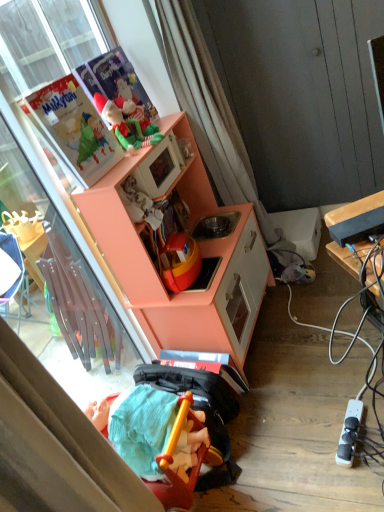
Question: Is peach matte cabinet at upper left situated inside green felt elf at upper center, arranged as the first toy when viewed from the top, or outside?

Choices:
 (A) inside
 (B) outside

Answer: (B)

Question: Based on their positions, is peach matte cabinet at upper left located to the left or right of green felt elf at upper center, the 2th toy when ordered from front to back?

Choices:
 (A) right
 (B) left

Answer: (A)

Question: Which is farther from the peach matte cabinet at upper left?

Choices:
 (A) green felt elf at upper center, arranged as the first toy when viewed from the top
 (B) transparent glass door at upper left
 (C) white sheer curtain at upper center
 (D) white plastic power outlet at lower right
 (E) black plastic tv at right

Answer: (D)

Question: Which of these objects is positioned farthest from the transparent glass door at upper left?

Choices:
 (A) green felt elf at upper center, arranged as the first toy when viewed from the top
 (B) rubberized plastic toy at lower center, arranged as the 2th toy when viewed from the top
 (C) black plastic tv at right
 (D) white sheer curtain at upper center
 (E) white plastic power outlet at lower right

Answer: (E)